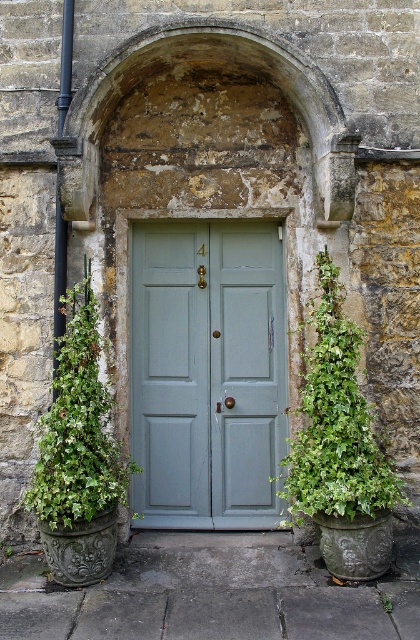
Is matte green door at center taller than green leafy plant at center?

Correct, matte green door at center is much taller as green leafy plant at center.

Who is positioned more to the right, matte green door at center or green leafy plant at center?

green leafy plant at center

At what (x,y) coordinates should I click in order to perform the action: click on matte green door at center. Please return your answer as a coordinate pair (x, y). Looking at the image, I should click on (207, 374).

Can you confirm if green leafy plant at center is smaller than green leafy plant at left?

No, green leafy plant at center is not smaller than green leafy plant at left.

Between point (391, 486) and point (102, 496), which one is positioned behind?

Positioned behind is point (391, 486).

You are a GUI agent. You are given a task and a screenshot of the screen. Output one action in this format:
    pyautogui.click(x=<x>, y=<y>)
    Task: Click on the green leafy plant at center
    Image resolution: width=420 pixels, height=640 pixels.
    Given the screenshot: What is the action you would take?
    pyautogui.click(x=336, y=420)

Is matte green door at center closer to camera compared to green leafy plant at left?

No.

Is matte green door at center to the left of green leafy plant at left from the viewer's perspective?

No, matte green door at center is not to the left of green leafy plant at left.

Find the location of a particular element. The height and width of the screenshot is (640, 420). matte green door at center is located at coordinates (207, 374).